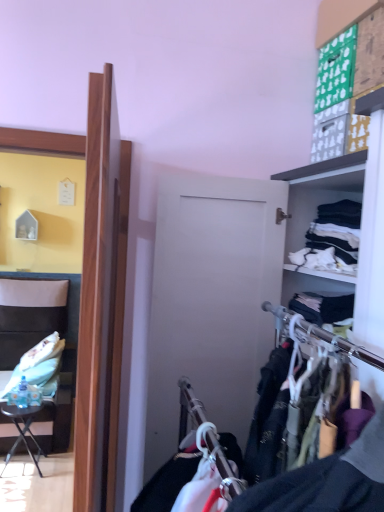
Locate an element on the screen. Image resolution: width=384 pixels, height=512 pixels. white cotton shirts at right, which is the second clothing from left to right is located at coordinates (333, 234).

What do you see at coordinates (38, 366) in the screenshot? The width and height of the screenshot is (384, 512). I see `white fabric pillow at left, the 1th clothing in the back-to-front sequence` at bounding box center [38, 366].

Image resolution: width=384 pixels, height=512 pixels. I want to click on white cotton shirts at right, the 1th clothing in the top-to-bottom sequence, so click(333, 234).

This screenshot has height=512, width=384. Find the location of `clothing on the right of black metal table at lower left`. clothing on the right of black metal table at lower left is located at coordinates (333, 234).

Which of these two, white cotton shirts at right, the 1th clothing from the right, or black metal table at lower left, is thinner?

Thinner between the two is white cotton shirts at right, the 1th clothing from the right.

Is black metal table at lower left located within white cotton shirts at right, which is the 2th clothing from back to front?

Actually, black metal table at lower left is outside white cotton shirts at right, which is the 2th clothing from back to front.

Is leatherette chair at left with white fabric pillow at left, acting as the first clothing starting from the bottom?

They are not placed beside each other.

From a real-world perspective, is leatherette chair at left on white fabric pillow at left, the second clothing from the front?

Yes, from a real-world perspective, leatherette chair at left is on top of white fabric pillow at left, the second clothing from the front.

Does leatherette chair at left lie in front of white fabric pillow at left, placed as the 1th clothing when sorted from left to right?

Yes, it is.

Between leatherette chair at left and white fabric pillow at left, acting as the first clothing starting from the bottom, which one has less height?

With less height is white fabric pillow at left, acting as the first clothing starting from the bottom.

Is black metal table at lower left closer to camera compared to white cotton shirts at right, which is the second clothing from left to right?

No, it is behind white cotton shirts at right, which is the second clothing from left to right.

Would you say black metal table at lower left is a long distance from white cotton shirts at right, the 1th clothing from the right?

Absolutely, black metal table at lower left is distant from white cotton shirts at right, the 1th clothing from the right.

How many degrees apart are the facing directions of black metal table at lower left and white cotton shirts at right, which is the 2th clothing from back to front?

90 degrees separate the facing orientations of black metal table at lower left and white cotton shirts at right, which is the 2th clothing from back to front.

Can we say black metal table at lower left lies outside white cotton shirts at right, which is the second clothing from left to right?

Absolutely, black metal table at lower left is external to white cotton shirts at right, which is the second clothing from left to right.

From the image's perspective, between black metal table at lower left and white fabric pillow at left, the second clothing from the front, which one is located above?

white fabric pillow at left, the second clothing from the front, from the image's perspective.

Is black metal table at lower left aimed at white fabric pillow at left, placed as the 1th clothing when sorted from left to right?

No, black metal table at lower left does not turn towards white fabric pillow at left, placed as the 1th clothing when sorted from left to right.

Which object is more forward, black metal table at lower left or white fabric pillow at left, placed as the 1th clothing when sorted from left to right?

black metal table at lower left is closer to the camera.

How far apart are black metal table at lower left and white fabric pillow at left, placed as the 1th clothing when sorted from left to right?

The distance of black metal table at lower left from white fabric pillow at left, placed as the 1th clothing when sorted from left to right, is 11.87 inches.

From the image's perspective, does leatherette chair at left appear lower than black metal table at lower left?

No, from the image's perspective, leatherette chair at left is not below black metal table at lower left.

Is point (49, 287) in front of point (20, 414)?

No, (49, 287) is further to viewer.

Does point (347, 253) come behind point (71, 407)?

No, it is not.

Could you tell me if white cotton shirts at right, which is the second clothing from left to right, is turned towards leatherette chair at left?

No, white cotton shirts at right, which is the second clothing from left to right, does not turn towards leatherette chair at left.

Which is behind, white cotton shirts at right, the 1th clothing from the right, or leatherette chair at left?

leatherette chair at left is further from the camera.

At what (x,y) coordinates should I click in order to perform the action: click on the 1st clothing located above the black metal table at lower left (from a real-world perspective). Please return your answer as a coordinate pair (x, y). This screenshot has width=384, height=512. Looking at the image, I should click on (38, 366).

What's the angular difference between white fabric pillow at left, acting as the first clothing starting from the bottom, and black metal table at lower left's facing directions?

There is a 0.398-degree angle between the facing directions of white fabric pillow at left, acting as the first clothing starting from the bottom, and black metal table at lower left.

From a real-world perspective, between white fabric pillow at left, placed as the 1th clothing when sorted from left to right, and black metal table at lower left, who is vertically higher?

In real-world perspective, white fabric pillow at left, placed as the 1th clothing when sorted from left to right, is above.

Considering the positions of points (53, 355) and (31, 416), is point (53, 355) closer to camera compared to point (31, 416)?

No, (53, 355) is further to viewer.

Image resolution: width=384 pixels, height=512 pixels. I want to click on table behind the white cotton shirts at right, which is the 2th clothing from back to front, so tap(23, 431).

The width and height of the screenshot is (384, 512). In order to click on chair in front of the white fabric pillow at left, the 1th clothing in the back-to-front sequence in this screenshot , I will do pyautogui.click(x=29, y=317).

Based on their spatial positions, is white fabric pillow at left, the 2th clothing when ordered from top to bottom, or black metal table at lower left closer to white cotton shirts at right, the 1th clothing in the top-to-bottom sequence?

white fabric pillow at left, the 2th clothing when ordered from top to bottom.

Based on their spatial positions, is black metal table at lower left or white cotton shirts at right, which is the second clothing from bottom to top, closer to leatherette chair at left?

black metal table at lower left.

From the image, which object appears to be nearer to white cotton shirts at right, which is the 2th clothing from back to front, black metal table at lower left or leatherette chair at left?

black metal table at lower left.

When comparing their distances from white cotton shirts at right, arranged as the 1th clothing when viewed from the front, does leatherette chair at left or black metal table at lower left seem further?

The object further to white cotton shirts at right, arranged as the 1th clothing when viewed from the front, is leatherette chair at left.

Looking at the image, which one is located closer to white cotton shirts at right, which is the second clothing from bottom to top, leatherette chair at left or white fabric pillow at left, arranged as the second clothing when viewed from the right?

white fabric pillow at left, arranged as the second clothing when viewed from the right, lies closer to white cotton shirts at right, which is the second clothing from bottom to top, than the other object.

Considering their positions, is white cotton shirts at right, arranged as the 1th clothing when viewed from the front, positioned further to white fabric pillow at left, the second clothing from the front, than leatherette chair at left?

white cotton shirts at right, arranged as the 1th clothing when viewed from the front, is positioned further to the anchor white fabric pillow at left, the second clothing from the front.

Which object lies nearer to the anchor point white fabric pillow at left, acting as the first clothing starting from the bottom, leatherette chair at left or white cotton shirts at right, arranged as the 1th clothing when viewed from the front?

Among the two, leatherette chair at left is located nearer to white fabric pillow at left, acting as the first clothing starting from the bottom.

Considering their positions, is white cotton shirts at right, which is the 2th clothing from back to front, positioned closer to leatherette chair at left than black metal table at lower left?

black metal table at lower left is positioned closer to the anchor leatherette chair at left.

Image resolution: width=384 pixels, height=512 pixels. I want to click on table between white cotton shirts at right, which is the 2th clothing from back to front, and white fabric pillow at left, acting as the first clothing starting from the bottom, from front to back, so click(23, 431).

At what (x,y) coordinates should I click in order to perform the action: click on chair between white cotton shirts at right, which is the second clothing from left to right, and white fabric pillow at left, the 1th clothing in the back-to-front sequence, along the z-axis. Please return your answer as a coordinate pair (x, y). The height and width of the screenshot is (512, 384). Looking at the image, I should click on (29, 317).

This screenshot has height=512, width=384. In order to click on table between leatherette chair at left and white cotton shirts at right, the 1th clothing in the top-to-bottom sequence, from left to right in this screenshot , I will do `click(23, 431)`.

I want to click on chair located between black metal table at lower left and white fabric pillow at left, the 1th clothing in the back-to-front sequence, in the depth direction, so click(29, 317).